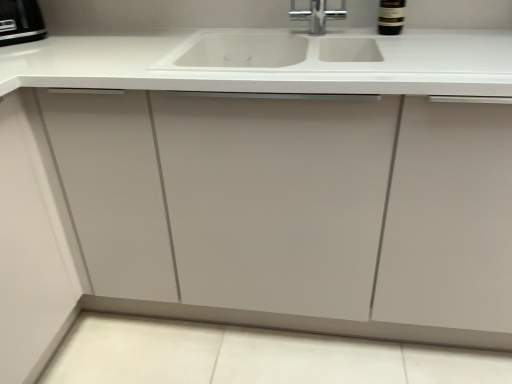
Question: Considering the positions of dark brown glass bottle at upper right and white matte sink at center in the image, is dark brown glass bottle at upper right wider or thinner than white matte sink at center?

Choices:
 (A) wide
 (B) thin

Answer: (B)

Question: Is dark brown glass bottle at upper right inside or outside of white matte sink at center?

Choices:
 (A) outside
 (B) inside

Answer: (A)

Question: Which object is positioned closest to the black plastic toaster at upper left?

Choices:
 (A) white matte sink at center
 (B) dark brown glass bottle at upper right

Answer: (A)

Question: Estimate the real-world distances between objects in this image. Which object is farther from the black plastic toaster at upper left?

Choices:
 (A) dark brown glass bottle at upper right
 (B) white matte sink at center

Answer: (A)